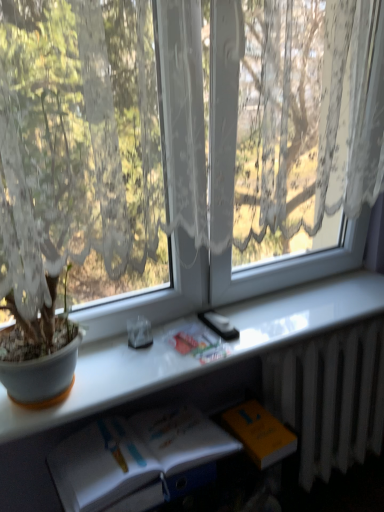
Locate an element on the screen. Image resolution: width=384 pixels, height=512 pixels. free spot to the left of matte plastic book at center, arranged as the 1th book when viewed from the top is located at coordinates [x=127, y=353].